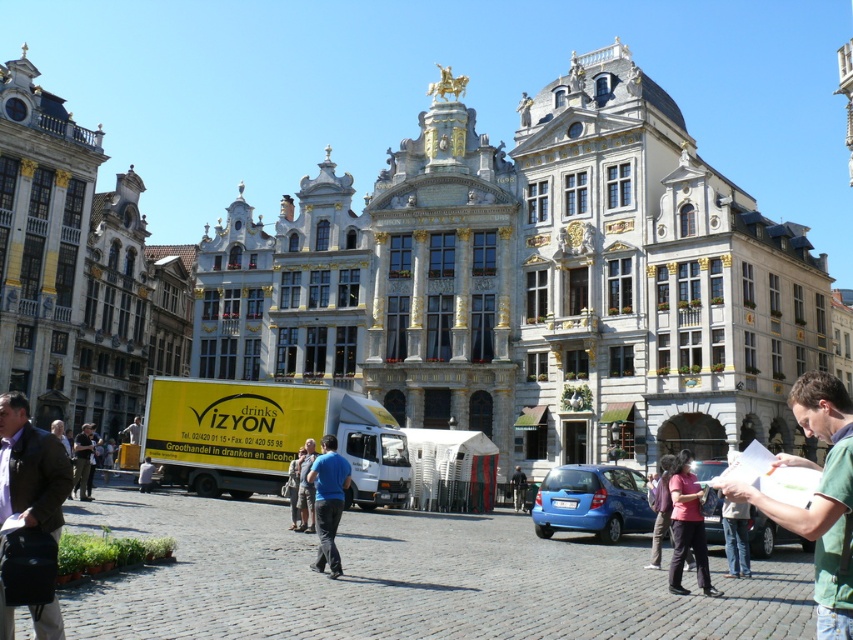
Question: Which object appears farthest from the camera in this image?

Choices:
 (A) green cotton shirt at lower right
 (B) blue cotton shirt at center
 (C) blue shirt at center

Answer: (C)

Question: Can you confirm if matte pink shirt at lower right is wider than camouflage pants at center?

Choices:
 (A) yes
 (B) no

Answer: (A)

Question: Which point appears farthest from the camera in this image?

Choices:
 (A) (308, 497)
 (B) (704, 547)

Answer: (A)

Question: Which is nearer to the brown leather jacket at lower left?

Choices:
 (A) dark blue jeans at lower left
 (B) camouflage pants at center
 (C) blue cotton shirt at center
 (D) matte pink shirt at lower right

Answer: (A)

Question: Can you confirm if matte pink shirt at center is smaller than dark blue jeans at lower left?

Choices:
 (A) no
 (B) yes

Answer: (B)

Question: In this image, where is green cotton shirt at lower right located relative to matte pink shirt at center?

Choices:
 (A) above
 (B) below

Answer: (A)